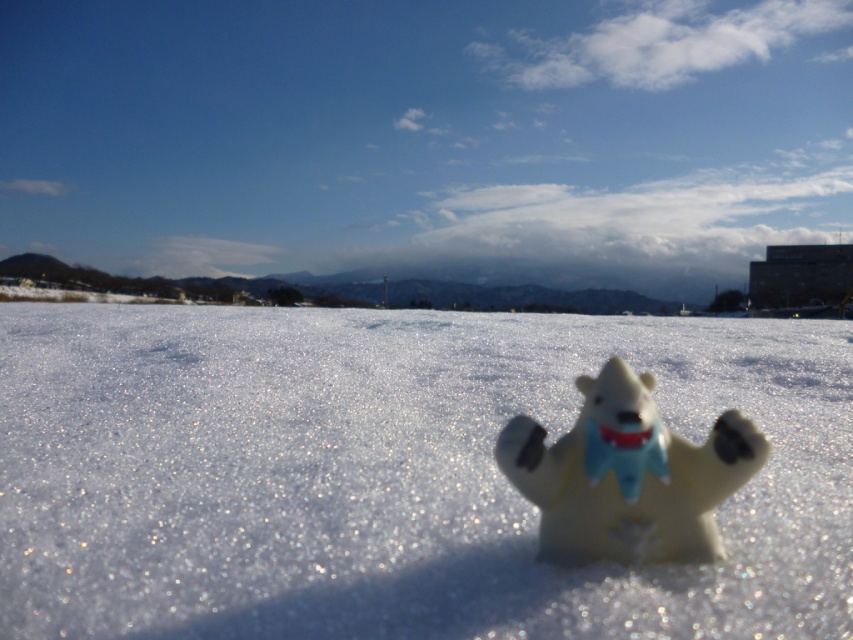
You are a photographer standing at the edge of the white matte snow at center. You want to take a picture of the white plastic bear at center. Is the bear visible in the photo if you look directly ahead?

The white matte snow at center is above the white plastic bear at center, so the bear may be partially or fully obscured by the snow in the photo.

You are a child who wants to place a small snow globe ornament on the white matte snow at center so it can be seen from the white plastic bear at center. The snow globe has a diameter of 3 inches. Is there enough space between them to place the ornament without it being in the way of the bear?

The white matte snow at center and white plastic bear at center are 16.62 inches apart. Since the snow globe has a diameter of 3 inches, placing it between them would leave 13.62 inches of space remaining. This should be sufficient for the ornament to be visible from the bear without obstructing its view.

You are a small polar bear figure wearing a light blue scarf with red accents. You are standing on the white matte snow at center and want to reach a candy cane placed 14.84 inches away from you. Can you easily walk to the candy cane without slipping?

The distance between you and the candy cane is exactly 14.84 inches, so you can easily walk to the candy cane without slipping since the white matte snow at center provides a stable surface for movement.